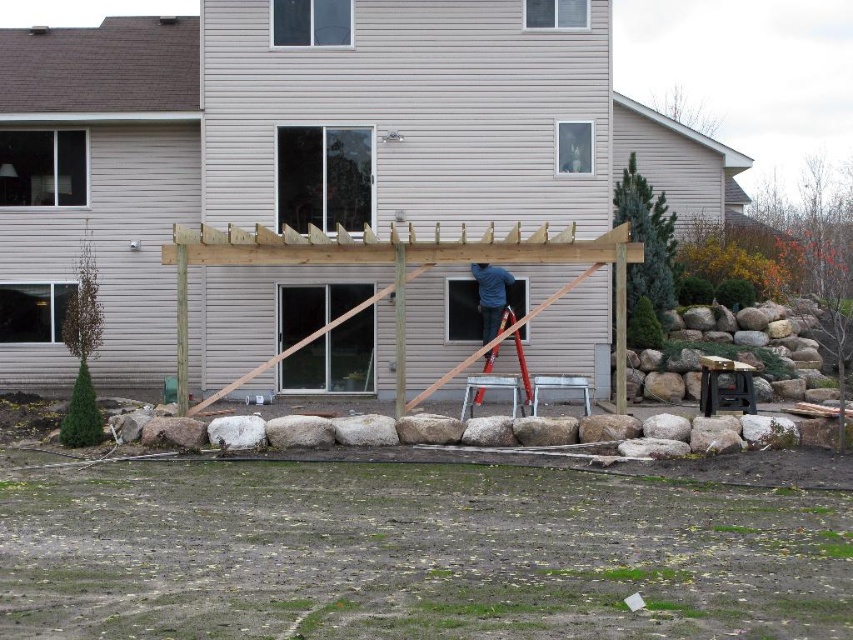
You are planning to place a decorative garden statue that requires a base area of 2 square meters. Given the sizes of the natural wood pergola at center and the metallic silver ladder at center, which object can accommodate the statue without overlapping?

The natural wood pergola at center is bigger than the metallic silver ladder at center, so the statue can be placed on the natural wood pergola at center as it has a larger base area.

Consider the image. You are standing at the origin point of the backyard. A natural wood pergola at center is located at coordinates point [305,144]. If you walk straight ahead, will you reach the natural wood pergola at center before reaching the red ladder near the window?

Yes, because the natural wood pergola at center is located at point [305,144], which is closer to your starting position than the red ladder near the window.

You are a contractor assessing the backyard construction site. You notice the dark blue shirt at center and the metallic silver ladder at center. Which object appears narrower from your viewpoint?

The dark blue shirt at center appears narrower since it has a lesser width compared to the metallic silver ladder at center.